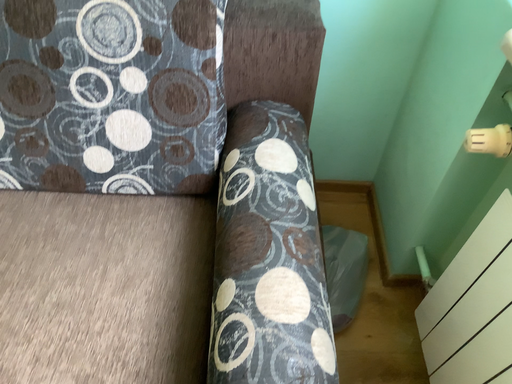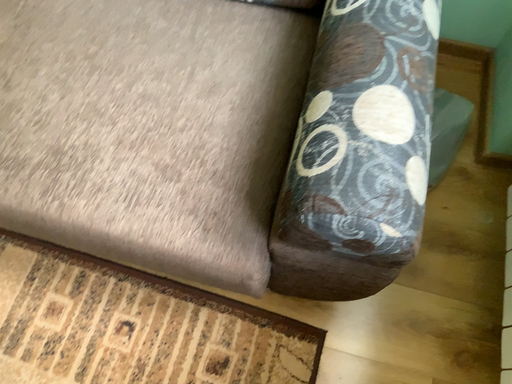
Question: How did the camera likely rotate when shooting the video?

Choices:
 (A) rotated downward
 (B) rotated upward

Answer: (A)